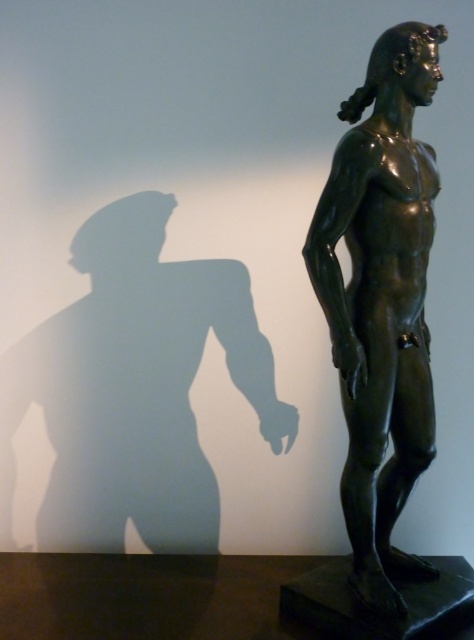
Does bronze statue at upper center have a greater height compared to shiny bronze statue at center?

Incorrect, bronze statue at upper center's height is not larger of shiny bronze statue at center's.

Is point (131, 380) farther from camera compared to point (364, 376)?

That is True.

Does point (110, 388) lie in front of point (358, 438)?

No, (110, 388) is further to viewer.

At what (x,y) coordinates should I click in order to perform the action: click on bronze statue at upper center. Please return your answer as a coordinate pair (x, y). The height and width of the screenshot is (640, 474). Looking at the image, I should click on (134, 388).